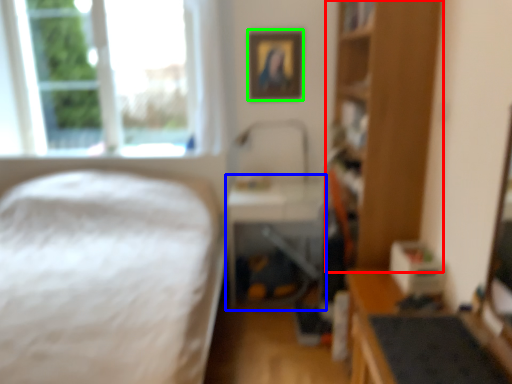
Question: Based on their relative distances, which object is farther from bookshelf (highlighted by a red box)? Choose from table (highlighted by a blue box) and picture frame (highlighted by a green box).

Choices:
 (A) table
 (B) picture frame

Answer: (B)